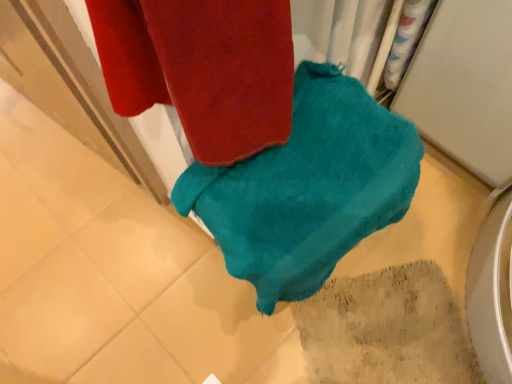
Describe the element at coordinates (386, 329) in the screenshot. I see `textured beige rug at lower right` at that location.

The height and width of the screenshot is (384, 512). I want to click on textured beige rug at lower right, so click(x=386, y=329).

Image resolution: width=512 pixels, height=384 pixels. What do you see at coordinates (308, 188) in the screenshot?
I see `teal soft towel at center` at bounding box center [308, 188].

The height and width of the screenshot is (384, 512). Identify the location of teal soft towel at center. (308, 188).

Image resolution: width=512 pixels, height=384 pixels. I want to click on textured beige rug at lower right, so click(x=386, y=329).

Based on the photo, visually, is teal soft towel at center positioned to the left or to the right of textured beige rug at lower right?

teal soft towel at center is positioned on textured beige rug at lower right's left side.

Is teal soft towel at center further to camera compared to textured beige rug at lower right?

No, it is not.

Is point (325, 197) positioned before point (461, 366)?

Yes, point (325, 197) is closer to viewer.

From the image's perspective, which one is positioned higher, teal soft towel at center or textured beige rug at lower right?

teal soft towel at center.

From a real-world perspective, does teal soft towel at center stand above textured beige rug at lower right?

Yes, from a real-world perspective, teal soft towel at center is over textured beige rug at lower right

In terms of width, does teal soft towel at center look wider or thinner when compared to textured beige rug at lower right?

teal soft towel at center is thinner than textured beige rug at lower right.

Can you confirm if teal soft towel at center is shorter than textured beige rug at lower right?

No.

Can you confirm if teal soft towel at center is smaller than textured beige rug at lower right?

No, teal soft towel at center is not smaller than textured beige rug at lower right.

Is teal soft towel at center inside or outside of textured beige rug at lower right?

teal soft towel at center is not inside textured beige rug at lower right, it's outside.

Is teal soft towel at center beside textured beige rug at lower right?

No, teal soft towel at center is not beside textured beige rug at lower right.

Is teal soft towel at center facing towards textured beige rug at lower right?

A: No.

I want to click on tile behind the teal soft towel at center, so click(x=386, y=329).

Does textured beige rug at lower right appear on the right side of teal soft towel at center?

Indeed, textured beige rug at lower right is positioned on the right side of teal soft towel at center.

Which is behind, textured beige rug at lower right or teal soft towel at center?

textured beige rug at lower right is more distant.

Which point is more distant from viewer, (x=347, y=334) or (x=286, y=149)?

The point (x=347, y=334) is more distant.

From the image's perspective, does textured beige rug at lower right appear lower than teal soft towel at center?

Yes.

From a real-world perspective, between textured beige rug at lower right and teal soft towel at center, who is vertically higher?

teal soft towel at center.

Looking at their sizes, would you say textured beige rug at lower right is wider or thinner than teal soft towel at center?

In the image, textured beige rug at lower right appears to be wider than teal soft towel at center.

Considering the sizes of objects textured beige rug at lower right and teal soft towel at center in the image provided, who is taller, textured beige rug at lower right or teal soft towel at center?

teal soft towel at center.

Considering the relative sizes of textured beige rug at lower right and teal soft towel at center in the image provided, is textured beige rug at lower right smaller than teal soft towel at center?

Indeed, textured beige rug at lower right has a smaller size compared to teal soft towel at center.

Is textured beige rug at lower right positioned beyond the bounds of teal soft towel at center?

Yes, textured beige rug at lower right is outside of teal soft towel at center.

Is textured beige rug at lower right beside teal soft towel at center?

There is a gap between textured beige rug at lower right and teal soft towel at center.

Is teal soft towel at center at the back of textured beige rug at lower right?

No, textured beige rug at lower right is not facing away from teal soft towel at center.

Can you tell me how much textured beige rug at lower right and teal soft towel at center differ in facing direction?

151 degrees separate the facing orientations of textured beige rug at lower right and teal soft towel at center.

How far apart are textured beige rug at lower right and teal soft towel at center?

textured beige rug at lower right is 17.42 inches from teal soft towel at center.

Find the location of a particular element. This screenshot has height=384, width=512. tile below the teal soft towel at center (from the image's perspective) is located at coordinates (386, 329).

This screenshot has width=512, height=384. In the image, there is a teal soft towel at center. In order to click on tile below it (from a real-world perspective) in this screenshot , I will do `click(386, 329)`.

You are a GUI agent. You are given a task and a screenshot of the screen. Output one action in this format:
    pyautogui.click(x=<x>, y=<y>)
    Task: Click on the tile behind the teal soft towel at center
    
    Given the screenshot: What is the action you would take?
    pyautogui.click(x=386, y=329)